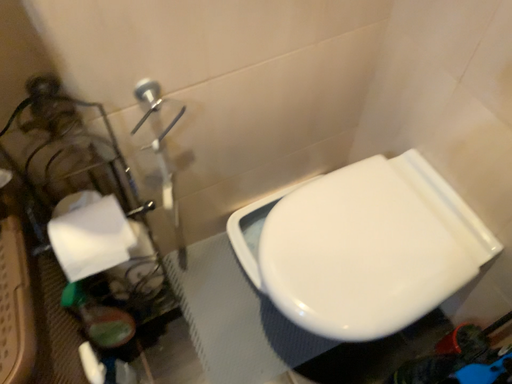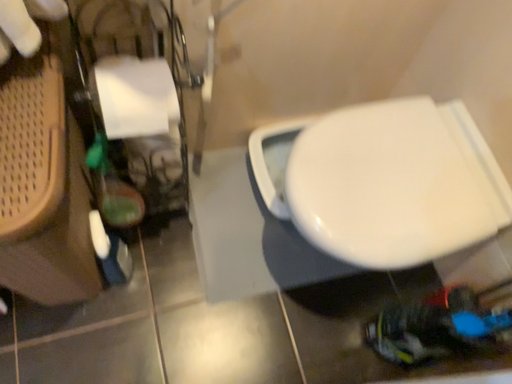
Question: How did the camera likely rotate when shooting the video?

Choices:
 (A) rotated upward
 (B) rotated downward

Answer: (B)